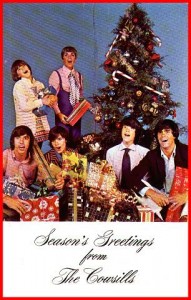
Identify the location of wall. (81, 33).